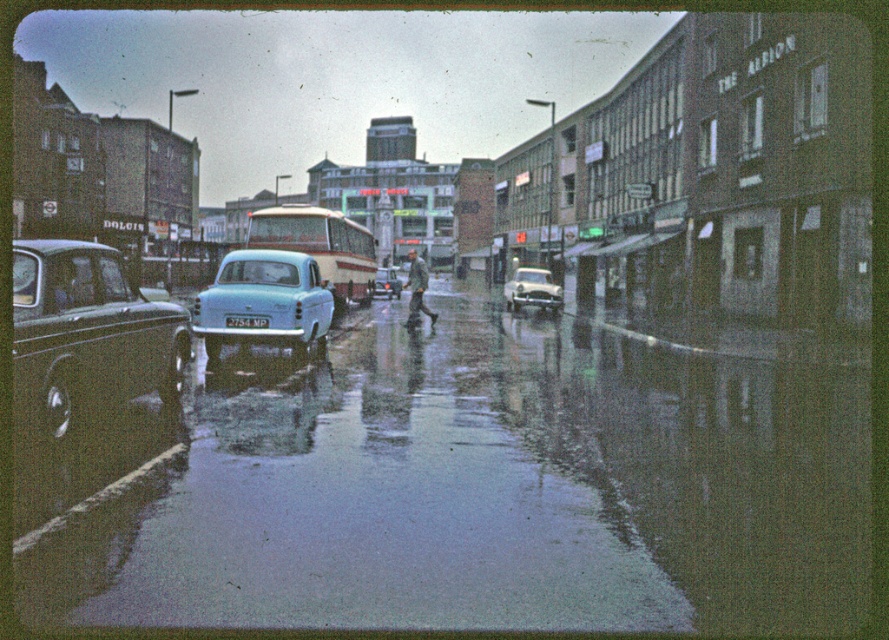
Question: Does beige fabric bus at center have a smaller size compared to white plastic license plate at center?

Choices:
 (A) yes
 (B) no

Answer: (B)

Question: Which object appears closest to the camera in this image?

Choices:
 (A) glossy asphalt water at center
 (B) beige fabric bus at center
 (C) light blue glossy car at center
 (D) shiny black sedan at left

Answer: (A)

Question: Is glossy asphalt water at center to the right of shiny black sedan at left from the viewer's perspective?

Choices:
 (A) no
 (B) yes

Answer: (B)

Question: Based on their relative distances, which object is farther from the beige fabric bus at center?

Choices:
 (A) light blue glossy car at center
 (B) shiny black sedan at left

Answer: (B)

Question: Can you confirm if light blue glossy sedan at center is bigger than white plastic license plate at center?

Choices:
 (A) no
 (B) yes

Answer: (B)

Question: Estimate the real-world distances between objects in this image. Which object is closer to the light blue glossy car at center?

Choices:
 (A) beige fabric bus at center
 (B) shiny black sedan at left

Answer: (A)